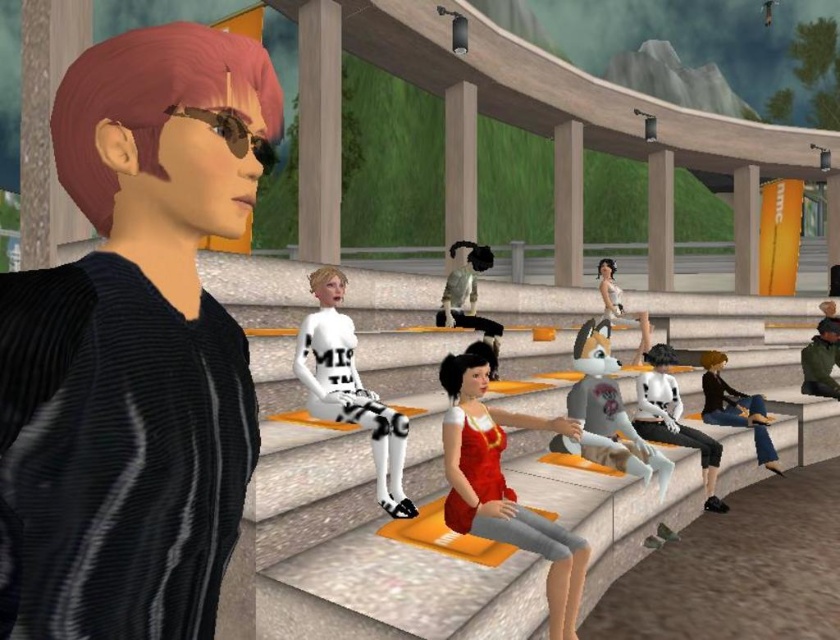
You are a character in the amphitheater and want to pick up the matte black sweater at left and the gray fabric dog at center. Which object should you move towards first if you are standing at the center of the amphitheater?

Since the matte black sweater at left is to the left of gray fabric dog at center, you should move towards the gray fabric dog at center first because it is closer to your current position at the center of the amphitheater.

Looking at this image, you are a character in the amphitheater and want to throw a ball to your dog. The white matte dog at center and the black matte dog at center are both in the scene. Which dog is closer to you if you are standing at the position of the character with short red hair and sunglasses?

The distance between the white matte dog at center and the black matte dog at center is 5.87 feet. Since both dogs are at the center, their distance from you depends on your position. However, without knowing the exact location of the character with short red hair and sunglasses relative to the center, it is impossible to determine which dog is closer.

You are a character in the amphitheater and want to pick up the matte black sweater at left and the gray fabric dog at center. Which object should you reach for first to grab both without moving your position?

You should reach for the matte black sweater at left first since it is closer to you than the gray fabric dog at center, allowing you to grab both items without moving.